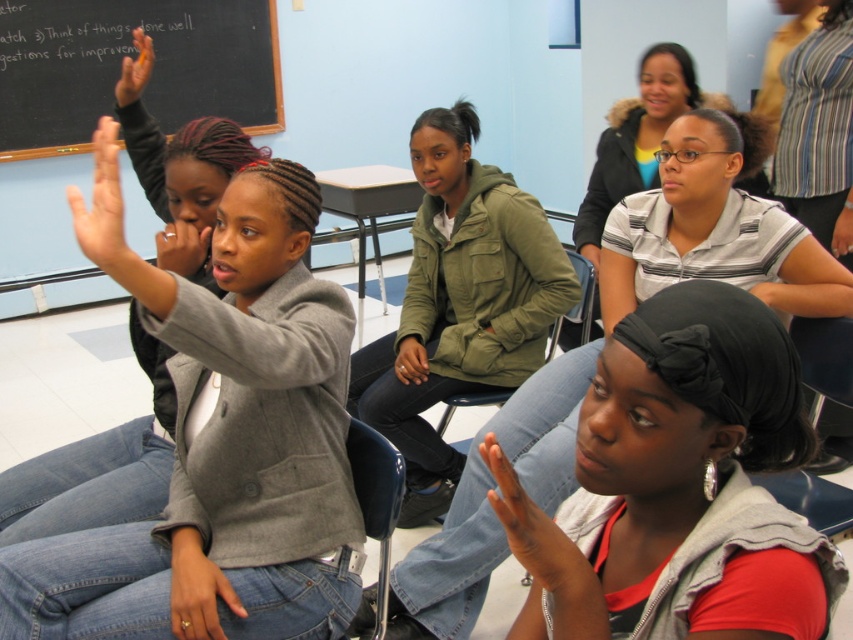
You are a student sitting in the classroom and notice a hand raised in the discussion. Where exactly is the smooth skin hand at lower center positioned in the image?

The smooth skin hand at lower center is positioned at coordinates point [535,534].

You are a student sitting in the classroom and you see the smooth skin hand at lower center and the matte black hand at upper left. Which hand is closer to your right side?

The smooth skin hand at lower center is positioned on the right side of the matte black hand at upper left, so it is closer to your right side.

In the classroom scene, you notice the olive green jacket at center and the matte gray hand at upper left. Which object takes up more space in the image?

The olive green jacket at center has a larger size compared to the matte gray hand at upper left, so it takes up more space in the image.